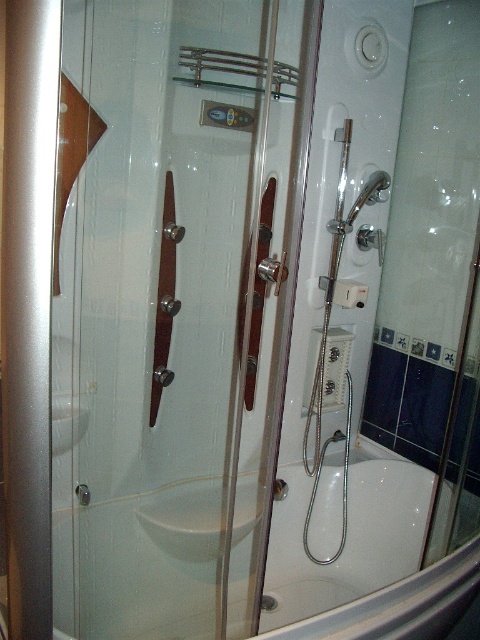
Question: Which object is positioned farthest from the satin silver screen door at left?

Choices:
 (A) transparent glass door at center
 (B) white glossy bathtub at center

Answer: (A)

Question: Does satin silver screen door at left come in front of white glossy bathtub at center?

Choices:
 (A) no
 (B) yes

Answer: (B)

Question: Considering the real-world distances, which object is farthest from the satin silver screen door at left?

Choices:
 (A) transparent glass door at center
 (B) white glossy bathtub at center

Answer: (A)

Question: Is satin silver screen door at left wider than white glossy bathtub at center?

Choices:
 (A) no
 (B) yes

Answer: (A)

Question: Can you confirm if transparent glass door at center is thinner than satin silver screen door at left?

Choices:
 (A) yes
 (B) no

Answer: (B)

Question: Estimate the real-world distances between objects in this image. Which object is farther from the transparent glass door at center?

Choices:
 (A) satin silver screen door at left
 (B) white glossy bathtub at center

Answer: (A)